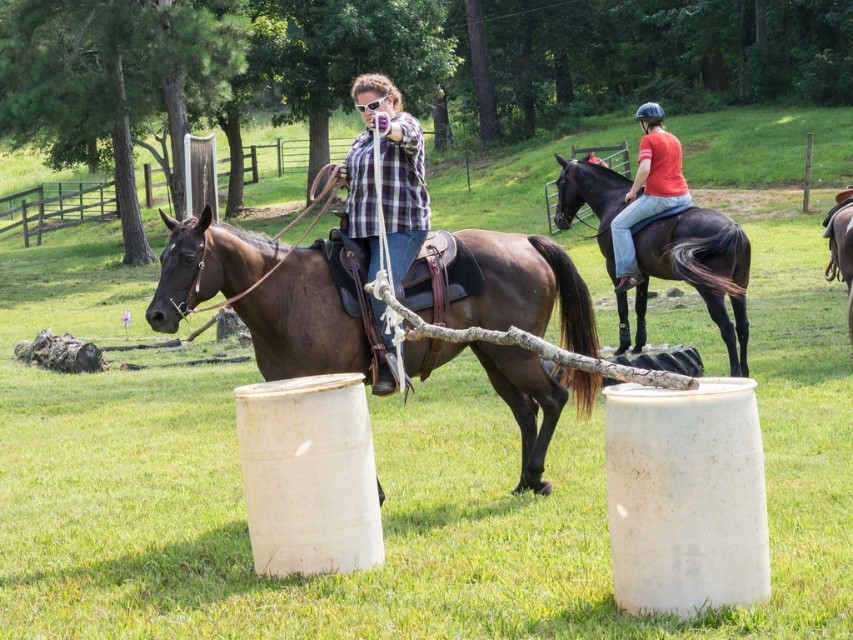
Question: Can you confirm if brown leather horse at center is positioned to the left of red cotton shirt at upper right?

Choices:
 (A) no
 (B) yes

Answer: (B)

Question: Which point is farther from the camera taking this photo?

Choices:
 (A) (349, 198)
 (B) (482, 355)

Answer: (B)

Question: Can you confirm if shiny black horse at upper right is smaller than plaid shirt at center?

Choices:
 (A) yes
 (B) no

Answer: (A)

Question: Which of the following is the farthest from the observer?

Choices:
 (A) shiny black horse at upper right
 (B) brown leather horse at center

Answer: (A)

Question: Is shiny black horse at upper right to the right of plaid shirt at center from the viewer's perspective?

Choices:
 (A) yes
 (B) no

Answer: (A)

Question: Which point is farther to the camera?

Choices:
 (A) brown leather horse at right
 (B) shiny black horse at upper right

Answer: (A)